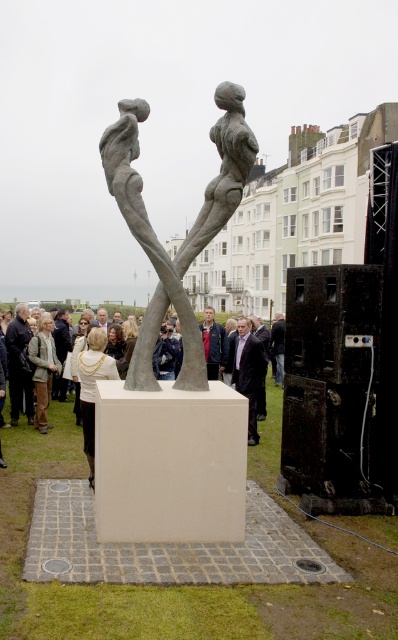
Question: Among these points, which one is nearest to the camera?

Choices:
 (A) tap(11, 408)
 (B) tap(220, 154)
 (C) tap(261, 339)
 (D) tap(282, 323)

Answer: (B)

Question: Which object appears farthest from the camera in this image?

Choices:
 (A) bronze sculpture at center
 (B) dark brown suit at center

Answer: (B)

Question: Is leather jacket at center bigger than dark suit at center?

Choices:
 (A) no
 (B) yes

Answer: (A)

Question: Is dark brown leather jacket at center positioned before light brown leather jacket at center?

Choices:
 (A) yes
 (B) no

Answer: (B)

Question: Is dark brown suit at center wider than light brown leather jacket at center?

Choices:
 (A) no
 (B) yes

Answer: (A)

Question: Which point is farther from the camera taking this photo?

Choices:
 (A) (13, 358)
 (B) (212, 326)

Answer: (B)